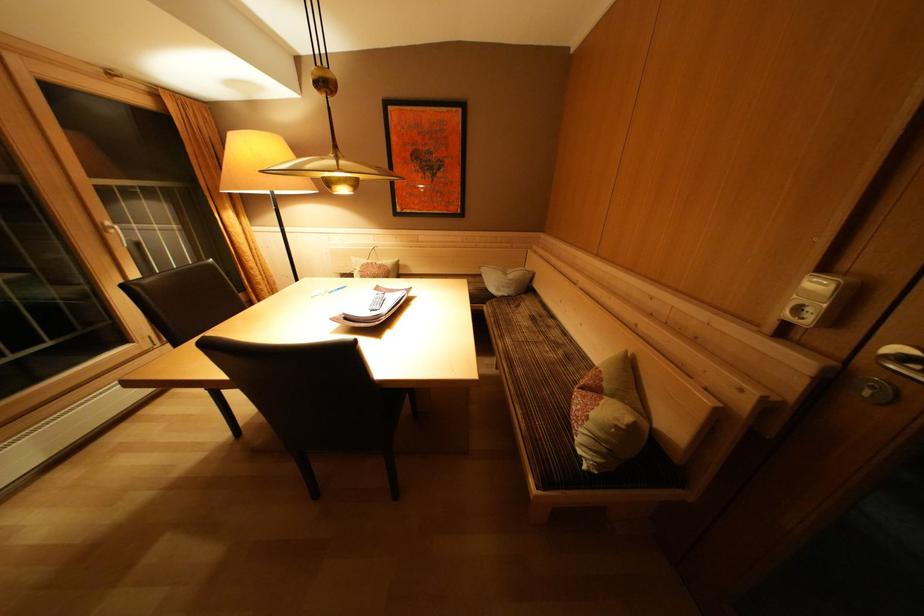
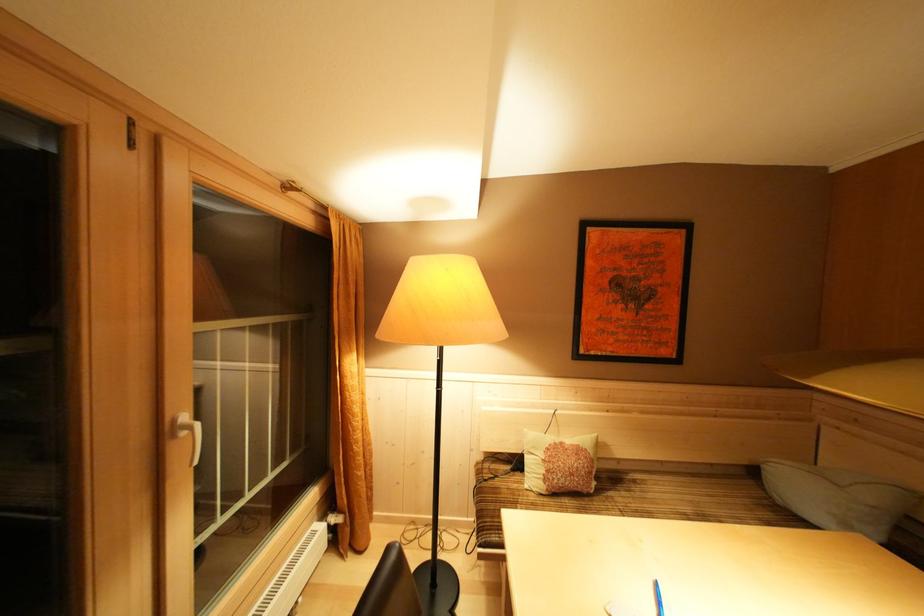
Find the pixel in the second image that matches pixel 517 281 in the first image.

(879, 503)